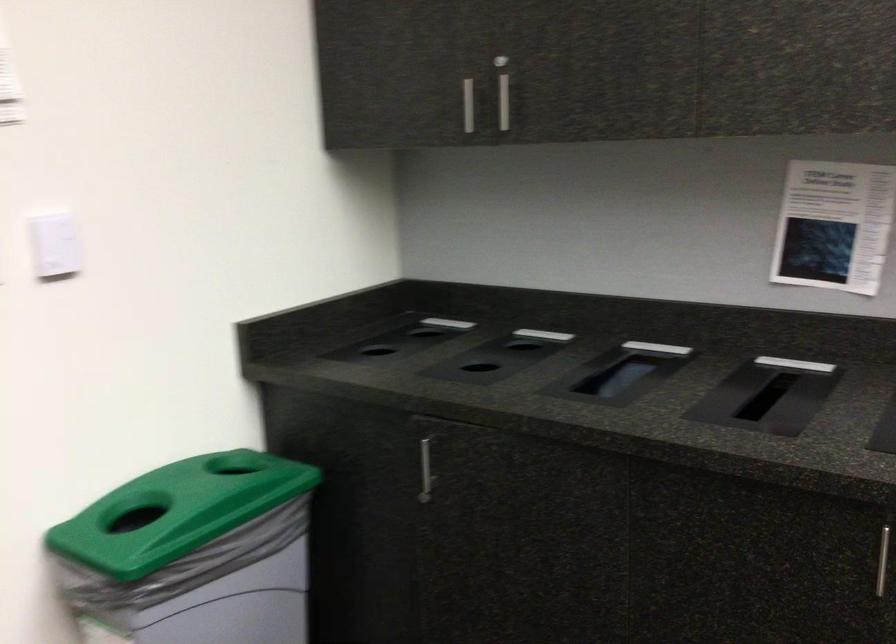
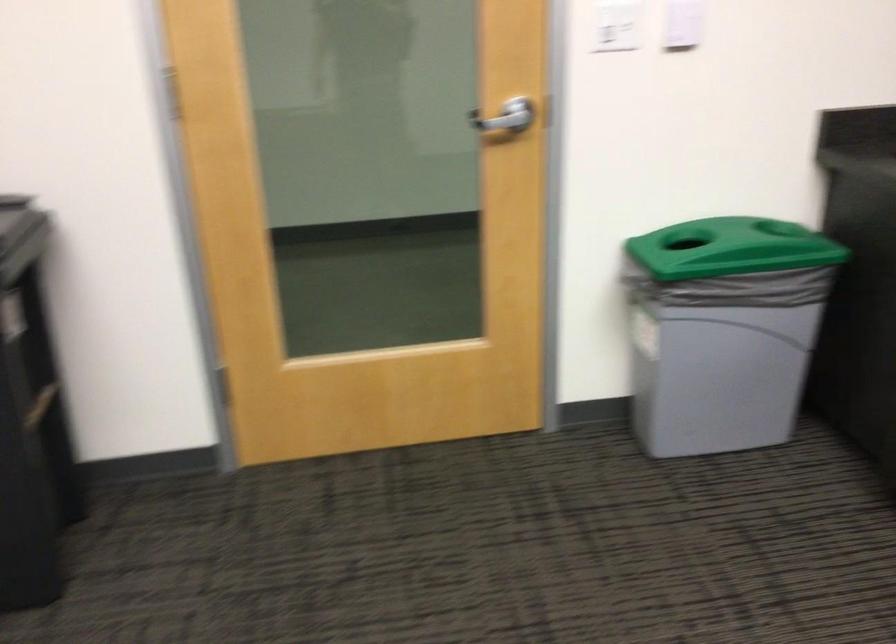
Where in the second image is the point corresponding to pixel 238 482 from the first image?

(759, 238)